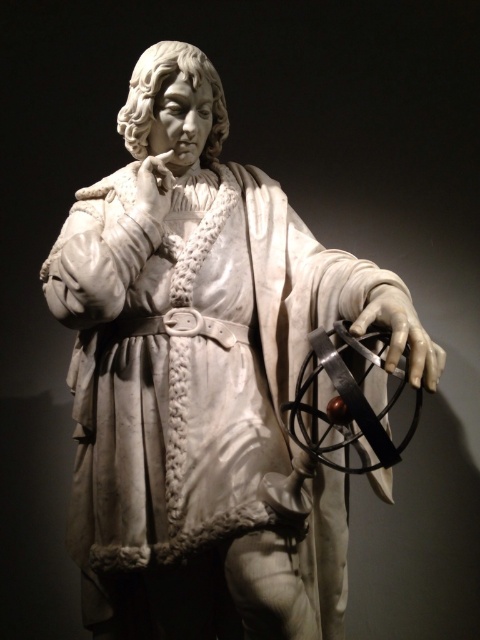
Question: Can you confirm if white marble sphere at center is positioned to the left of white marble hand at center?

Choices:
 (A) yes
 (B) no

Answer: (B)

Question: Which point is closer to the camera?

Choices:
 (A) white marble sphere at center
 (B) white marble hand at center

Answer: (A)

Question: Can you confirm if white marble sphere at center is bigger than white marble hand at center?

Choices:
 (A) yes
 (B) no

Answer: (A)

Question: Which point appears closest to the camera in this image?

Choices:
 (A) (409, 349)
 (B) (136, 198)

Answer: (A)

Question: Which object is farther from the camera taking this photo?

Choices:
 (A) white marble sphere at center
 (B) white marble hand at center

Answer: (B)

Question: Does white marble sphere at center have a larger size compared to white marble hand at center?

Choices:
 (A) yes
 (B) no

Answer: (A)